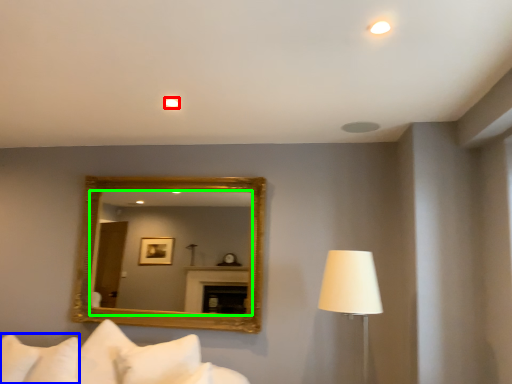
Question: Considering the real-world distances, which object is closest to lighting (highlighted by a red box)? pillow (highlighted by a blue box) or mirror (highlighted by a green box).

Choices:
 (A) pillow
 (B) mirror

Answer: (A)